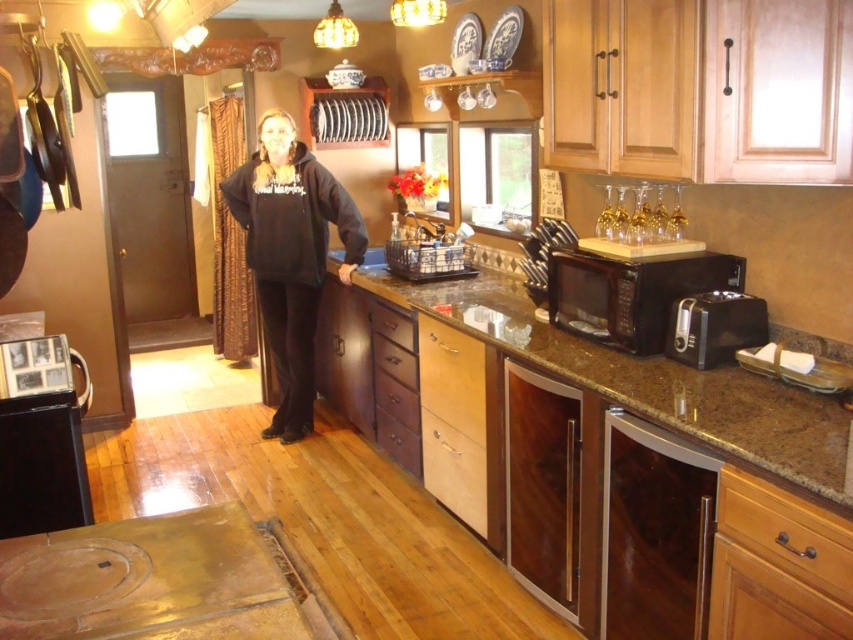
Question: Which of the following is the farthest from the observer?

Choices:
 (A) black fleece hoodie at center
 (B) satin stainless steel dishwasher at lower right
 (C) brown granite countertop at center
 (D) black plastic toaster at right

Answer: (A)

Question: Which point is farther from the camera taking this photo?

Choices:
 (A) (398, 289)
 (B) (624, 320)
 (C) (640, 474)
 (D) (693, 348)

Answer: (A)

Question: Does brown granite countertop at center come in front of black matte microwave at right?

Choices:
 (A) no
 (B) yes

Answer: (B)

Question: Which object is farther from the camera taking this photo?

Choices:
 (A) satin stainless steel dishwasher at lower right
 (B) brown granite countertop at center
 (C) black fleece hoodie at center
 (D) black plastic toaster at right

Answer: (C)

Question: Can you confirm if satin stainless steel dishwasher at lower right is wider than black plastic toaster at right?

Choices:
 (A) no
 (B) yes

Answer: (A)

Question: Is brown granite countertop at center wider than black matte microwave at right?

Choices:
 (A) no
 (B) yes

Answer: (B)